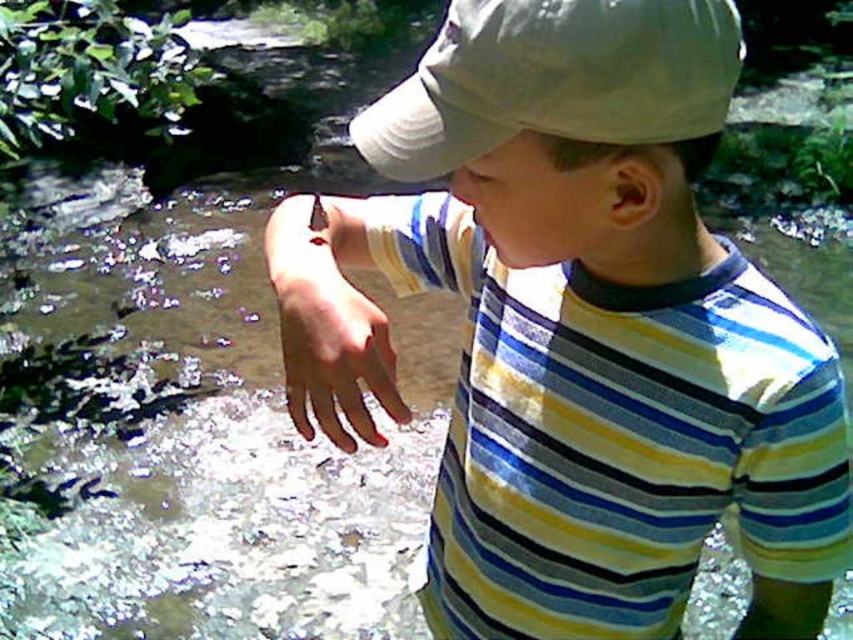
Question: Based on their relative distances, which object is farther from the matte striped shirt at center?

Choices:
 (A) pale skin hand at center
 (B) white fabric cap at upper center

Answer: (B)

Question: Which is farther from the white fabric cap at upper center?

Choices:
 (A) pale skin hand at center
 (B) matte striped shirt at center

Answer: (B)

Question: Does white fabric cap at upper center appear on the right side of pale skin hand at center?

Choices:
 (A) no
 (B) yes

Answer: (B)

Question: Does matte striped shirt at center have a larger size compared to pale skin hand at center?

Choices:
 (A) yes
 (B) no

Answer: (A)

Question: Among these points, which one is nearest to the camera?

Choices:
 (A) (535, 51)
 (B) (347, 406)

Answer: (A)

Question: Does white fabric cap at upper center have a greater width compared to pale skin hand at center?

Choices:
 (A) yes
 (B) no

Answer: (A)